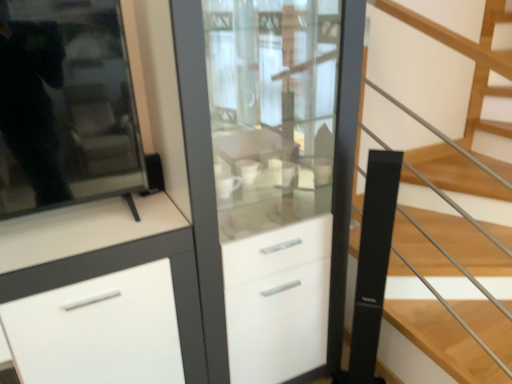
Question: From the image's perspective, is black matte stair at center positioned above or below white glossy cabinet at center?

Choices:
 (A) above
 (B) below

Answer: (A)

Question: From a real-world perspective, is black matte stair at center positioned above or below white glossy cabinet at center?

Choices:
 (A) above
 (B) below

Answer: (A)

Question: Based on their relative distances, which object is nearer to the white glossy cabinet at center?

Choices:
 (A) black matte stair at center
 (B) white matte cabinet at center

Answer: (B)

Question: Which object is the closest to the white glossy cabinet at center?

Choices:
 (A) white matte cabinet at center
 (B) black matte stair at center

Answer: (A)